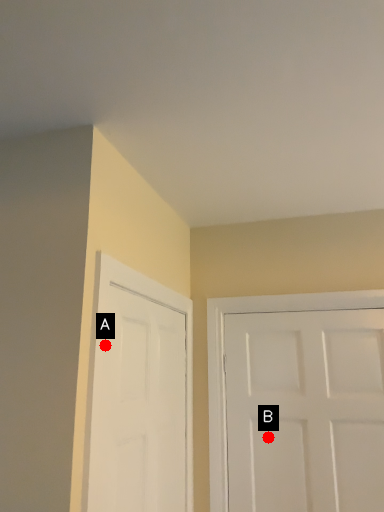
Question: Two points are circled on the image, labeled by A and B beside each circle. Which of the following is the farthest from the observer?

Choices:
 (A) A is further
 (B) B is further

Answer: (B)